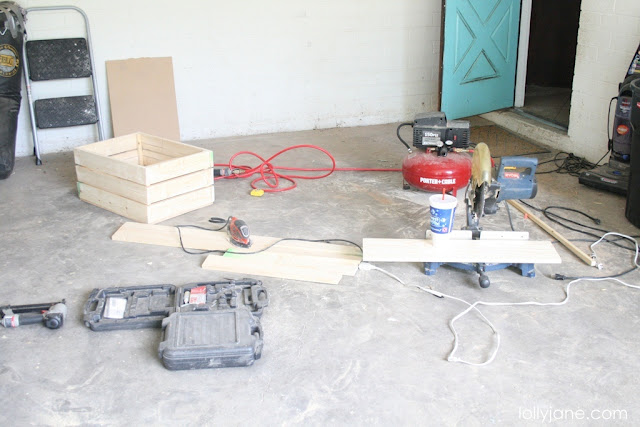
Where is `step ladder`? This screenshot has height=427, width=640. step ladder is located at coordinates (58, 111).